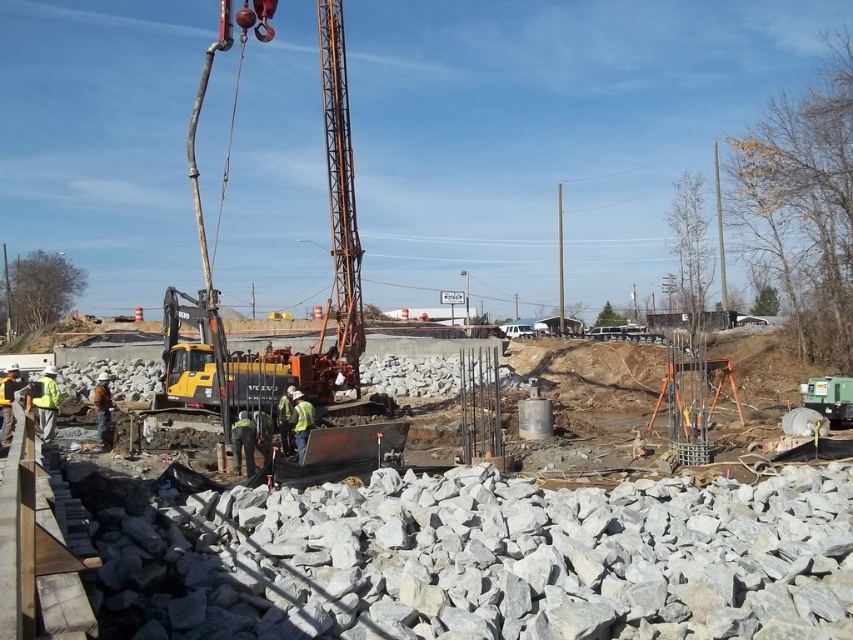
Question: Which point is closer to the camera?

Choices:
 (A) gray concrete construction site at center
 (B) yellow metallic excavator at center

Answer: (A)

Question: Which of the following is the closest to the observer?

Choices:
 (A) yellow metallic excavator at center
 (B) gray concrete construction site at center

Answer: (B)

Question: Which of the following is the closest to the observer?

Choices:
 (A) yellow metallic excavator at center
 (B) gray concrete construction site at center

Answer: (B)

Question: Does gray concrete construction site at center appear on the left side of yellow metallic excavator at center?

Choices:
 (A) yes
 (B) no

Answer: (B)

Question: Can you confirm if gray concrete construction site at center is wider than yellow metallic excavator at center?

Choices:
 (A) no
 (B) yes

Answer: (A)

Question: Can you confirm if gray concrete construction site at center is positioned to the left of yellow metallic excavator at center?

Choices:
 (A) yes
 (B) no

Answer: (B)